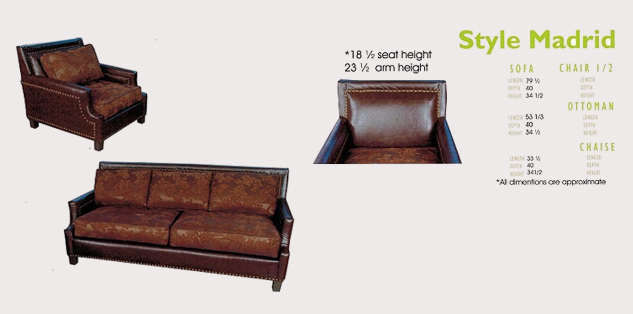
Locate an element on the screen. the back pillow of chair is located at coordinates (70, 71).